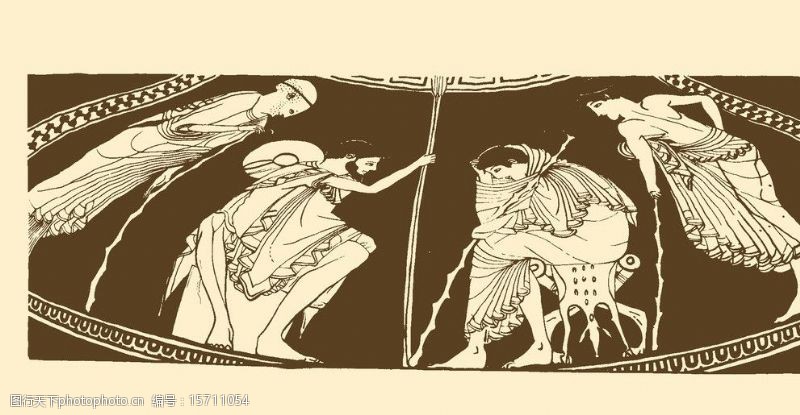
Identify the location of art. Image resolution: width=800 pixels, height=415 pixels. (394, 259).